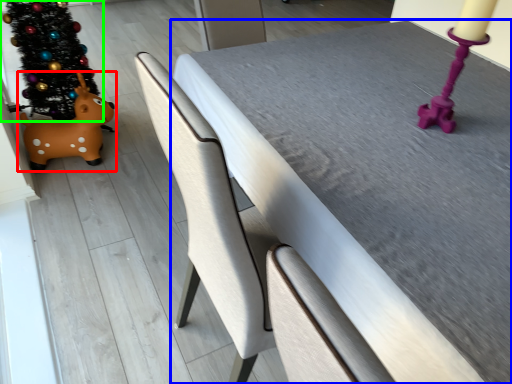
Question: Which is farther away from toy (highlighted by a red box)? table (highlighted by a blue box) or christmas tree (highlighted by a green box)?

Choices:
 (A) table
 (B) christmas tree

Answer: (A)